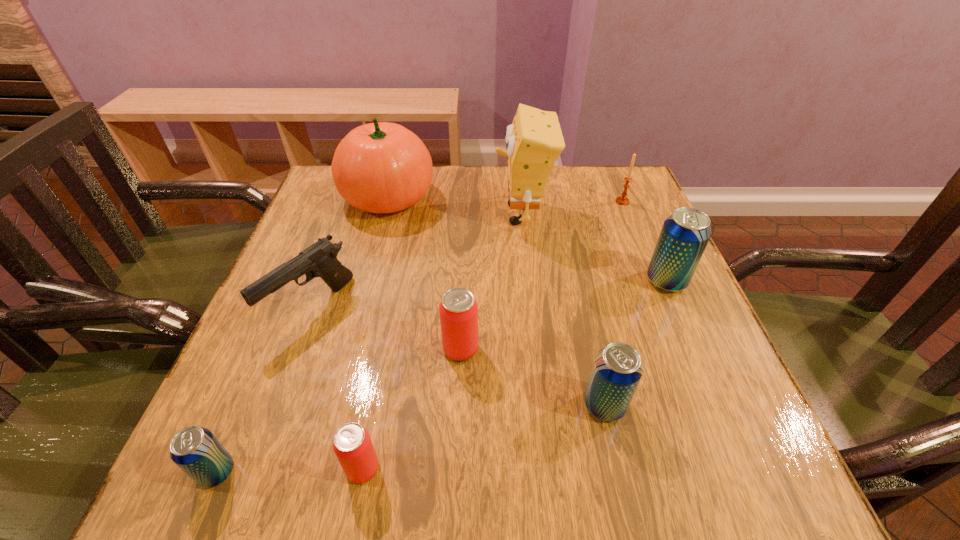
Where is `the nearest blue beer can`? the nearest blue beer can is located at coordinates (195, 450).

I want to click on the smallest blue beer can, so click(195, 450).

Locate an element on the screen. The image size is (960, 540). the smaller red beer can is located at coordinates (352, 444).

Where is `the fourth beer can from right to left`? The width and height of the screenshot is (960, 540). the fourth beer can from right to left is located at coordinates (352, 444).

Where is `vacant space situated 0.140m on the face of the yellow sponge`? This screenshot has height=540, width=960. vacant space situated 0.140m on the face of the yellow sponge is located at coordinates (438, 214).

This screenshot has width=960, height=540. I want to click on free space located on the face of the yellow sponge, so click(x=442, y=214).

You are a GUI agent. You are given a task and a screenshot of the screen. Output one action in this format:
    pyautogui.click(x=<x>, y=<y>)
    Task: Click on the vacant space located 0.070m on the face of the yellow sponge
    
    Given the screenshot: What is the action you would take?
    pyautogui.click(x=466, y=214)

The height and width of the screenshot is (540, 960). I want to click on blank space located 0.130m on the front of the eighth shortest object, so click(371, 261).

You are a GUI agent. You are given a task and a screenshot of the screen. Output one action in this format:
    pyautogui.click(x=<x>, y=<y>)
    Task: Click on the free location located on the front of the rightmost beer can
    
    Given the screenshot: What is the action you would take?
    pyautogui.click(x=718, y=400)

The image size is (960, 540). In order to click on free spot located 0.160m on the left of the candle_holder in this screenshot , I will do `click(554, 201)`.